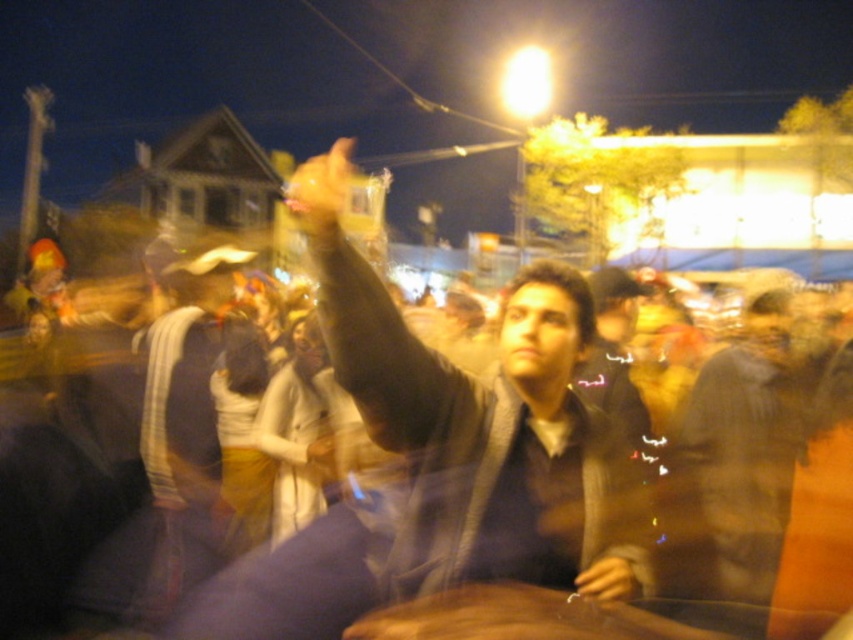
You are at a nighttime event and see two items in the image. The first is a matte black jacket at center, and the second is a yellow rubber glove at upper center. Which item is positioned to the right of the other?

The matte black jacket at center is to the right of yellow rubber glove at upper center.